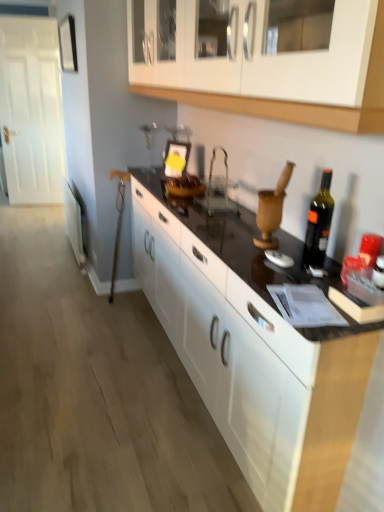
Question: Based on their sizes in the image, would you say white glossy cabinet at upper center is bigger or smaller than black glossy countertop at center?

Choices:
 (A) small
 (B) big

Answer: (A)

Question: Is white glossy cabinet at upper center situated inside black glossy countertop at center or outside?

Choices:
 (A) inside
 (B) outside

Answer: (B)

Question: Estimate the real-world distances between objects in this image. Which object is farther from the black glass bottle at right?

Choices:
 (A) black glossy countertop at center
 (B) white glossy cabinet at upper center

Answer: (B)

Question: Estimate the real-world distances between objects in this image. Which object is farther from the black glossy countertop at center?

Choices:
 (A) white glossy cabinet at upper center
 (B) black glass bottle at right

Answer: (A)